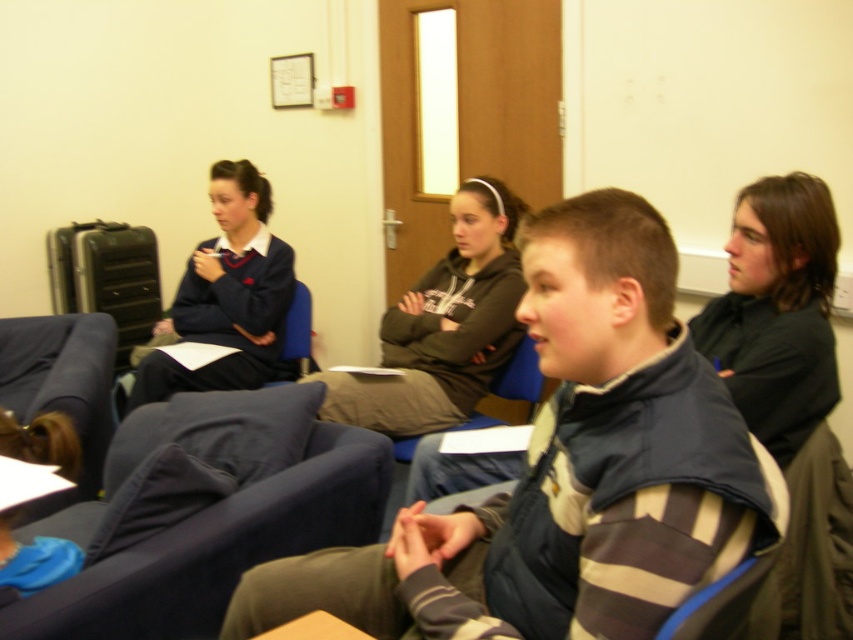
You are standing at the entrance of the classroom and see the black shirt at right and the matte blue uniform at left. Which person is nearer to you?

The black shirt at right is closer to the viewer than the matte blue uniform at left, so the person in the black shirt at right is nearer to you.

You are standing in the classroom and want to point out two specific points on the wall. The first point is at coordinates point (453,371) and the second is at point (206,248). Which of these two points is closer to your current position?

Point (453,371) is closer to the camera than point (206,248), so the first point is closer to your current position.

You are standing at the entrance of the classroom and want to greet the dark gray hoodie at center and the matte blue uniform at left. Which person should you approach first based on their positions?

You should approach the dark gray hoodie at center first because it is closer to you than the matte blue uniform at left.